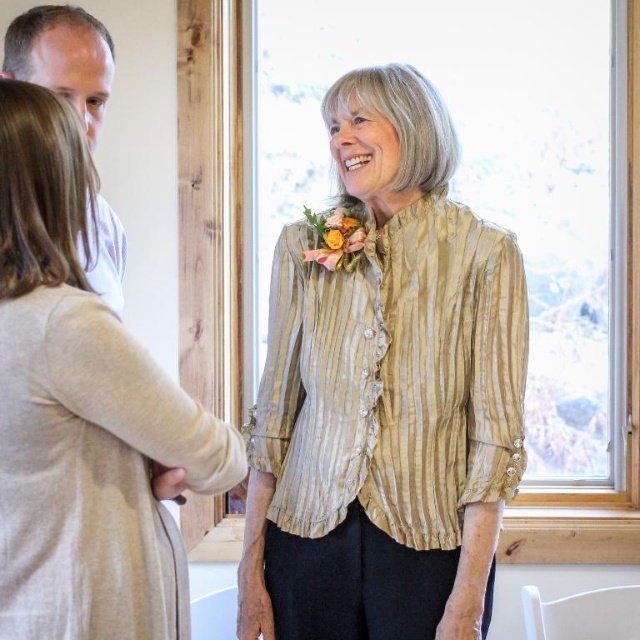
Which of these two, light beige textured cardigan at left or vibrant floral bouquet at center, stands taller?

light beige textured cardigan at left is taller.

Does light beige textured cardigan at left have a greater width compared to vibrant floral bouquet at center?

Yes.

Who is more distant from viewer, (24,291) or (349,243)?

Positioned behind is point (349,243).

Locate an element on the screen. Image resolution: width=640 pixels, height=640 pixels. light beige textured cardigan at left is located at coordinates coord(83,412).

Can you confirm if gold striped blouse at center is positioned to the left of light beige textured cardigan at left?

Incorrect, gold striped blouse at center is not on the left side of light beige textured cardigan at left.

The width and height of the screenshot is (640, 640). What are the coordinates of `gold striped blouse at center` in the screenshot? It's located at (387, 394).

I want to click on gold striped blouse at center, so click(x=387, y=394).

Looking at this image, is light beige textured cardigan at left to the left of white cotton shirt at upper left from the viewer's perspective?

No, light beige textured cardigan at left is not to the left of white cotton shirt at upper left.

In the scene shown: Is light beige textured cardigan at left positioned in front of white cotton shirt at upper left?

Yes, it is in front of white cotton shirt at upper left.

Locate an element on the screen. The width and height of the screenshot is (640, 640). light beige textured cardigan at left is located at coordinates (83, 412).